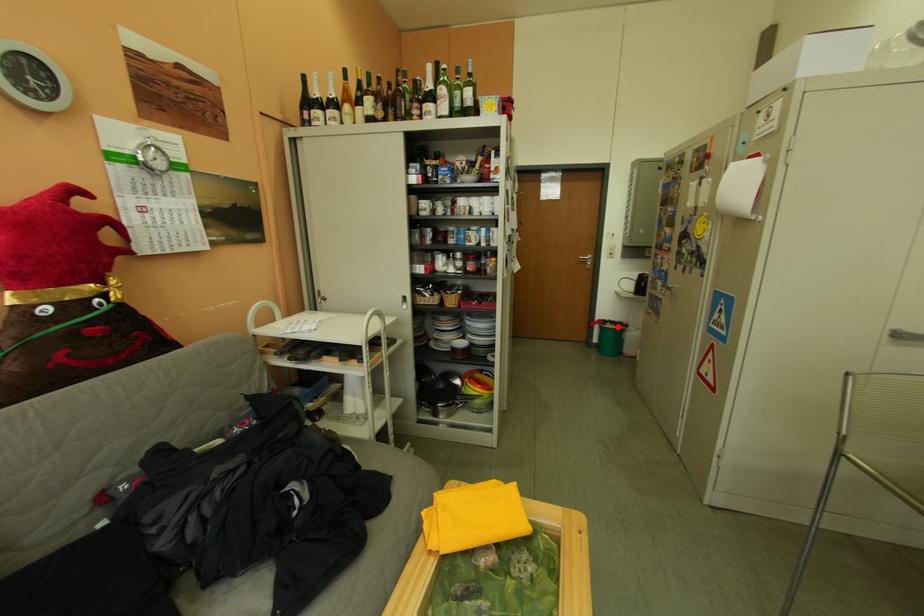
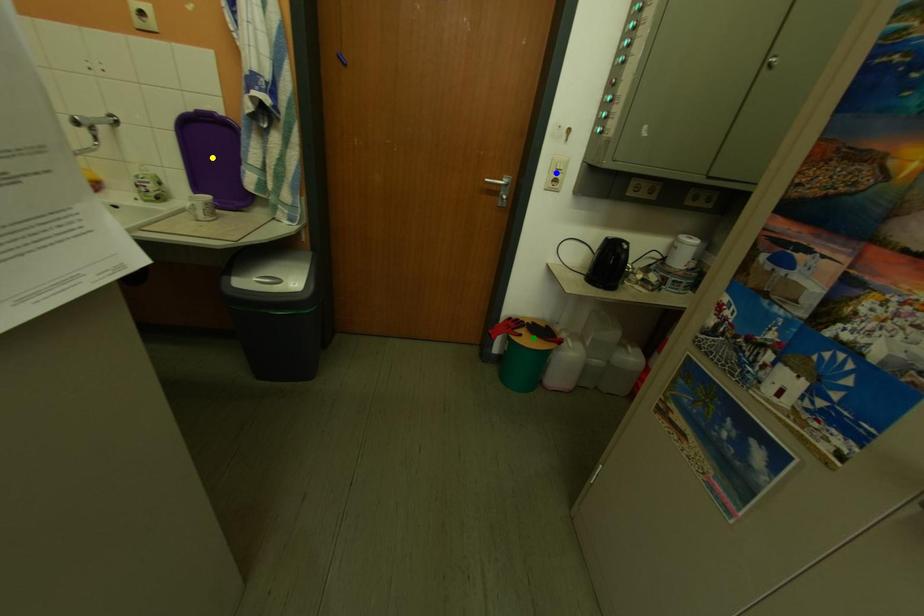
Question: I am providing you with two images of the same scene from different viewpoints. A red point is marked on the first image. You are given multiple points on the second image. Which mark in image 2 goes with the point in image 1?

Choices:
 (A) blue point
 (B) green point
 (C) yellow point

Answer: (B)